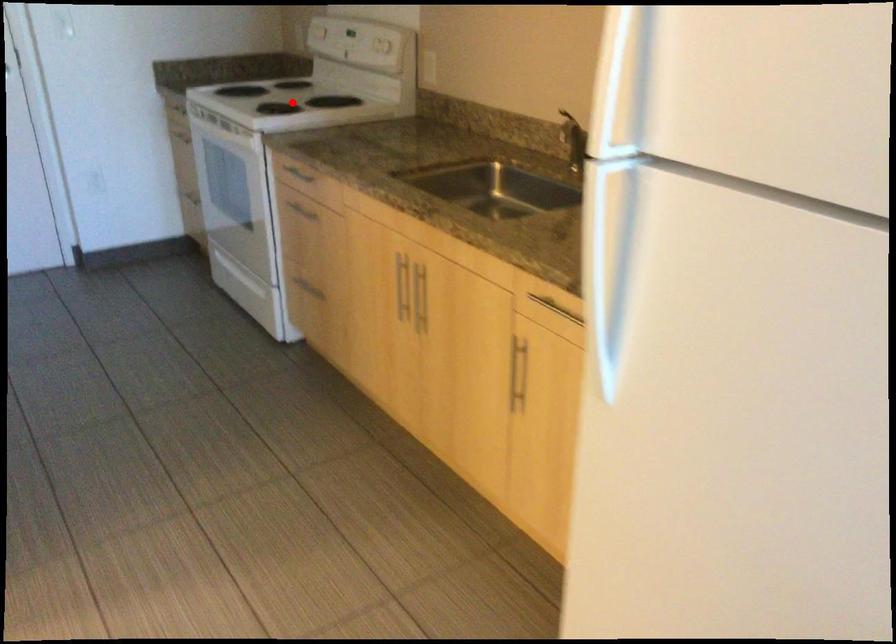
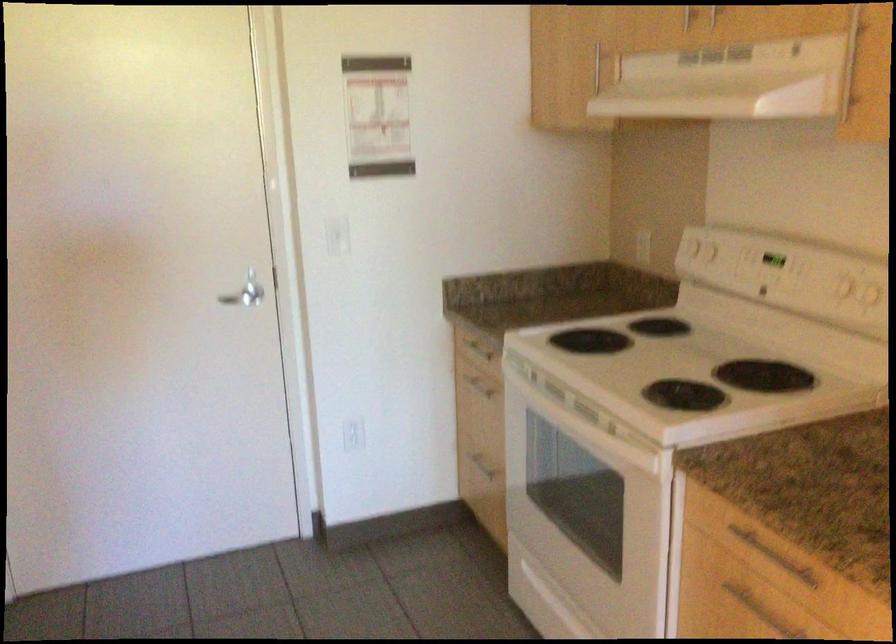
Question: I am providing you with two images of the same scene from different viewpoints. Given a red point in image1, look at the same physical point in image2. Is it:

Choices:
 (A) Closer to the viewpoint
 (B) Farther from the viewpoint

Answer: (A)